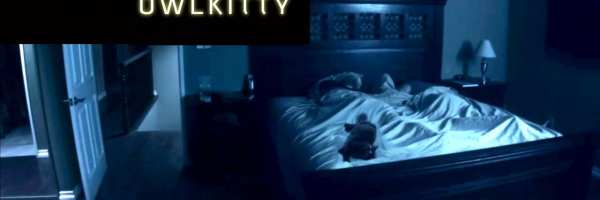
I want to click on lamp, so click(490, 52).